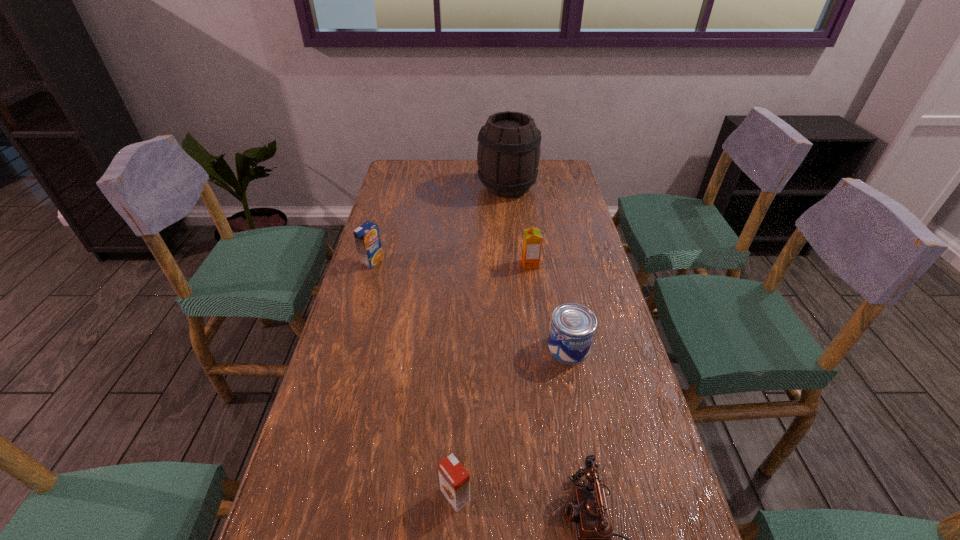
Identify the location of vacant region located 0.360m on the front label of the can. This screenshot has height=540, width=960. click(x=603, y=523).

Identify the location of blank space located 0.330m on the back of the shortest orange juice. The height and width of the screenshot is (540, 960). (462, 349).

Identify the location of object that is at the far edge. (508, 154).

At what (x,y) coordinates should I click in order to perform the action: click on object present at the left edge. Please return your answer as a coordinate pair (x, y). The height and width of the screenshot is (540, 960). Looking at the image, I should click on (367, 237).

You are a GUI agent. You are given a task and a screenshot of the screen. Output one action in this format:
    pyautogui.click(x=<x>, y=<y>)
    Task: Click on the wine bucket situated at the right edge
    
    Given the screenshot: What is the action you would take?
    pyautogui.click(x=508, y=154)

What are the coordinates of `can situated at the right edge` in the screenshot? It's located at (572, 329).

You are a GUI agent. You are given a task and a screenshot of the screen. Output one action in this format:
    pyautogui.click(x=<x>, y=<y>)
    Task: Click on the object that is at the far right corner
    The height and width of the screenshot is (540, 960).
    Given the screenshot: What is the action you would take?
    pyautogui.click(x=508, y=154)

Locate an element on the screen. free location at the left edge of the desktop is located at coordinates (419, 206).

This screenshot has height=540, width=960. In order to click on empty location between the third nearest object and the nearest orange juice in this screenshot , I will do `click(512, 422)`.

I want to click on empty space between the rightmost orange juice and the leftmost object, so click(451, 263).